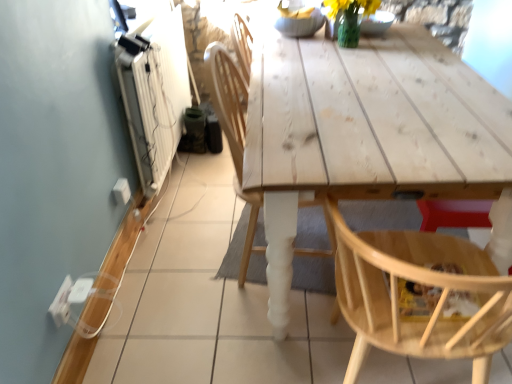
This screenshot has height=384, width=512. Find the location of `vacant space underneath wooden chair at center, the 2th chair when ordered from right to left (from a real-world perspective)`. vacant space underneath wooden chair at center, the 2th chair when ordered from right to left (from a real-world perspective) is located at coordinates (308, 250).